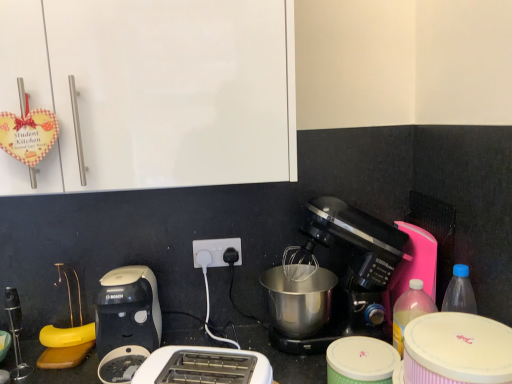
Question: Should I look upward or downward to see green polka dot container at lower center, placed as the 1th appliance when sorted from bottom to top?

Choices:
 (A) down
 (B) up

Answer: (A)

Question: Does pink striped container at lower right, which appears as the first appliance when viewed from the top, have a larger size compared to white glossy cabinet at upper left?

Choices:
 (A) no
 (B) yes

Answer: (A)

Question: Can you confirm if pink striped container at lower right, which appears as the first appliance when viewed from the top, is wider than white glossy cabinet at upper left?

Choices:
 (A) no
 (B) yes

Answer: (A)

Question: Is pink striped container at lower right, acting as the second appliance starting from the bottom, aimed at white glossy cabinet at upper left?

Choices:
 (A) no
 (B) yes

Answer: (A)

Question: From the image's perspective, is pink striped container at lower right, which appears as the first appliance when viewed from the top, beneath white glossy cabinet at upper left?

Choices:
 (A) yes
 (B) no

Answer: (A)

Question: Is pink striped container at lower right, acting as the second appliance starting from the bottom, positioned before white glossy cabinet at upper left?

Choices:
 (A) no
 (B) yes

Answer: (B)

Question: Does pink striped container at lower right, which appears as the first appliance when viewed from the top, have a smaller size compared to white glossy cabinet at upper left?

Choices:
 (A) yes
 (B) no

Answer: (A)

Question: From the image's perspective, is white plastic power plugs and sockets at center below white plastic toaster at lower left, which ranks as the first toaster in left-to-right order?

Choices:
 (A) no
 (B) yes

Answer: (A)

Question: From the image's perspective, is white plastic power plugs and sockets at center on white plastic toaster at lower left, which is counted as the second toaster, starting from the right?

Choices:
 (A) yes
 (B) no

Answer: (A)

Question: Does white plastic power plugs and sockets at center have a greater width compared to white plastic toaster at lower left, the first toaster positioned from the back?

Choices:
 (A) no
 (B) yes

Answer: (A)

Question: Would you consider white plastic power plugs and sockets at center to be distant from white plastic toaster at lower left, which ranks as the first toaster in left-to-right order?

Choices:
 (A) yes
 (B) no

Answer: (B)

Question: Considering the relative positions of white plastic power plugs and sockets at center and white plastic toaster at lower left, the first toaster positioned from the back, in the image provided, is white plastic power plugs and sockets at center to the right of white plastic toaster at lower left, the first toaster positioned from the back, from the viewer's perspective?

Choices:
 (A) yes
 (B) no

Answer: (A)

Question: Is white plastic power plugs and sockets at center located outside white plastic toaster at lower left, the first toaster positioned from the back?

Choices:
 (A) yes
 (B) no

Answer: (A)

Question: Does black plastic coffee maker at center have a greater height compared to white plastic toaster at lower left, the first toaster positioned from the back?

Choices:
 (A) no
 (B) yes

Answer: (B)